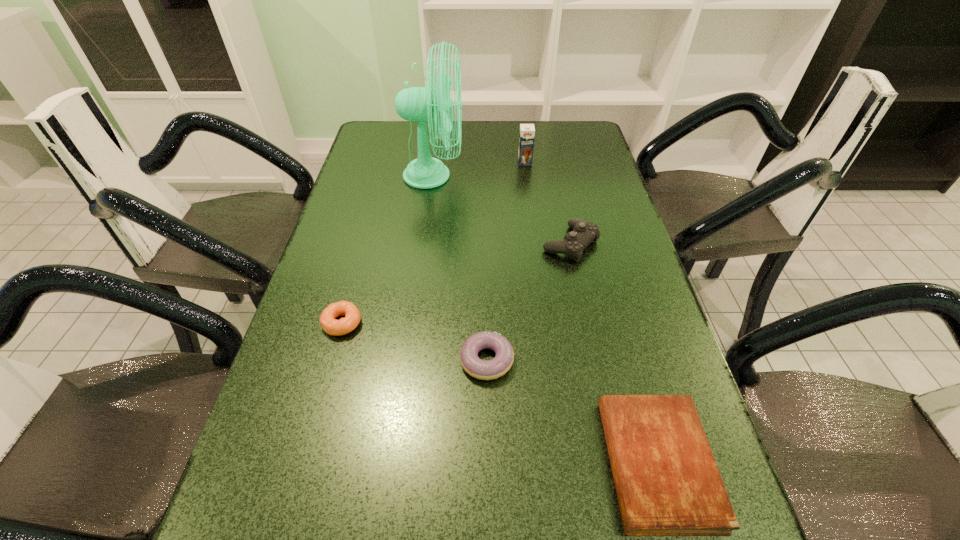
Find the location of a particular element. The image size is (960, 540). vacant area that satisfies the following two spatial constraints: 1. on the front label of the second tallest object; 2. in front of the second object from left to right to blow air is located at coordinates (526, 176).

The image size is (960, 540). I want to click on free space that satisfies the following two spatial constraints: 1. on the front label of the fifth shortest object; 2. on the right side of the control, so click(x=536, y=244).

Image resolution: width=960 pixels, height=540 pixels. Identify the location of free space that satisfies the following two spatial constraints: 1. in front of the fifth object from right to left to blow air; 2. on the back side of the right doughnut. (410, 360).